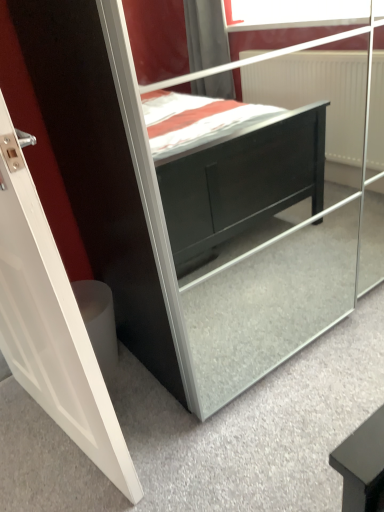
The width and height of the screenshot is (384, 512). Identify the location of vacant space underneath white glossy door at left (from a real-world perspective). 61,436.